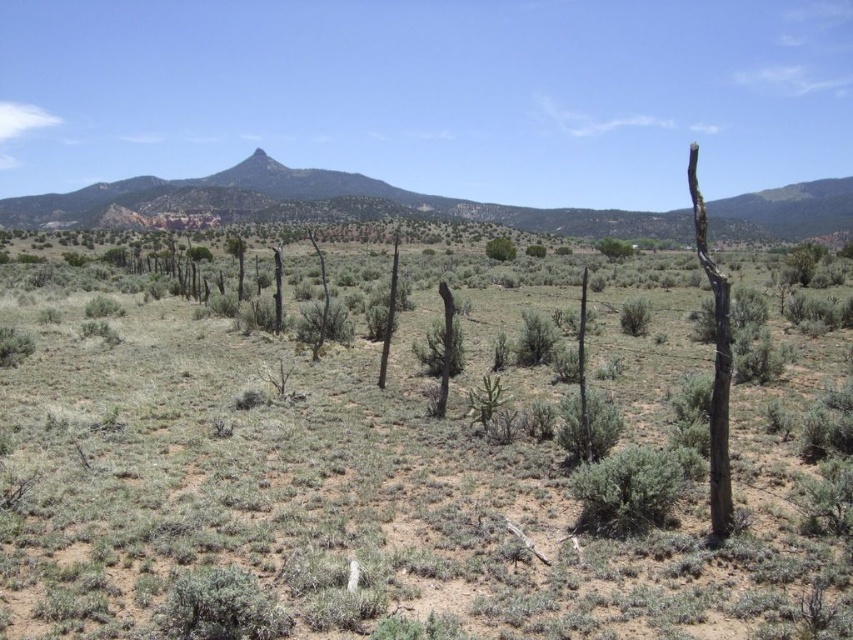
Question: Among these objects, which one is nearest to the camera?

Choices:
 (A) brown rough tree trunk at right
 (B) green shrubs at center
 (C) brown rough tree trunk at center
 (D) green shrub at center

Answer: (B)

Question: Is green shrub at center bigger than brown rough tree trunk at center?

Choices:
 (A) no
 (B) yes

Answer: (A)

Question: Can you confirm if green shrub at center is thinner than green leafy bush at center?

Choices:
 (A) no
 (B) yes

Answer: (B)

Question: Which point is farther to the camera?

Choices:
 (A) brown rough tree trunk at right
 (B) green shrub at center
 (C) brown rough tree trunk at center

Answer: (C)

Question: Which object is farther from the camera taking this photo?

Choices:
 (A) green shrub at center
 (B) brown rough tree trunk at right
 (C) green leafy bush at center

Answer: (C)

Question: Can you confirm if brown rough tree trunk at right is smaller than green leafy bush at center?

Choices:
 (A) yes
 (B) no

Answer: (B)